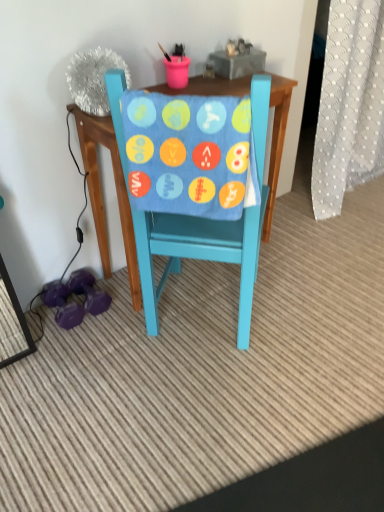
Identify the location of free space in front of teal painted wood chair at center. The height and width of the screenshot is (512, 384). (208, 406).